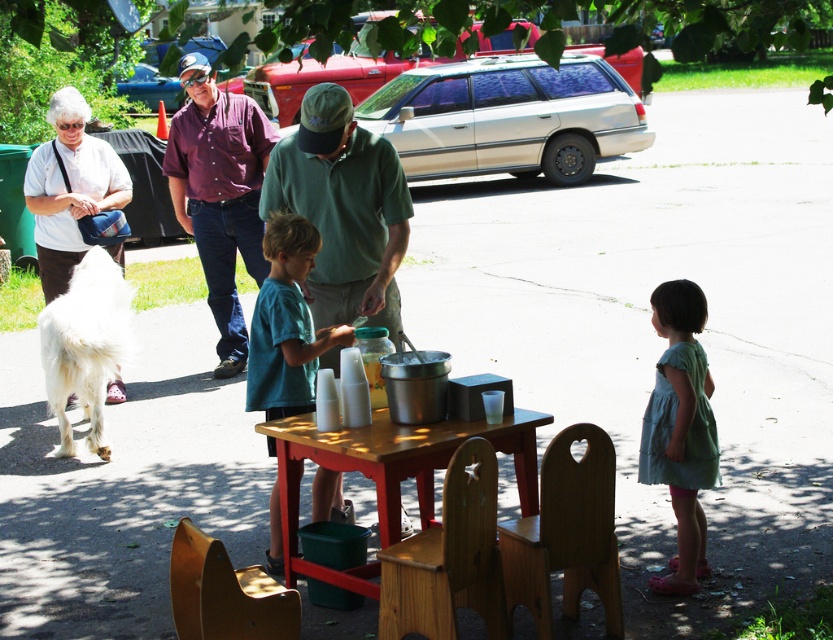
Question: Does maroon button-down shirt at upper left have a greater width compared to teal t-shirt at center?

Choices:
 (A) no
 (B) yes

Answer: (B)

Question: Which of the following is the farthest from the observer?

Choices:
 (A) (183, 196)
 (B) (318, 493)
 (C) (273, 422)

Answer: (A)

Question: Estimate the real-world distances between objects in this image. Which object is closer to the white fabric purse at left?

Choices:
 (A) wooden table at center
 (B) maroon button-down shirt at upper left
 (C) green cotton dress at lower right

Answer: (B)

Question: From the image, what is the correct spatial relationship of wooden table at center in relation to teal t-shirt at center?

Choices:
 (A) right
 (B) left

Answer: (A)

Question: Estimate the real-world distances between objects in this image. Which object is farther from the teal t-shirt at center?

Choices:
 (A) green matte shirt at center
 (B) green cotton dress at lower right

Answer: (B)

Question: Where is green matte shirt at center located in relation to maroon button-down shirt at upper left in the image?

Choices:
 (A) right
 (B) left

Answer: (A)